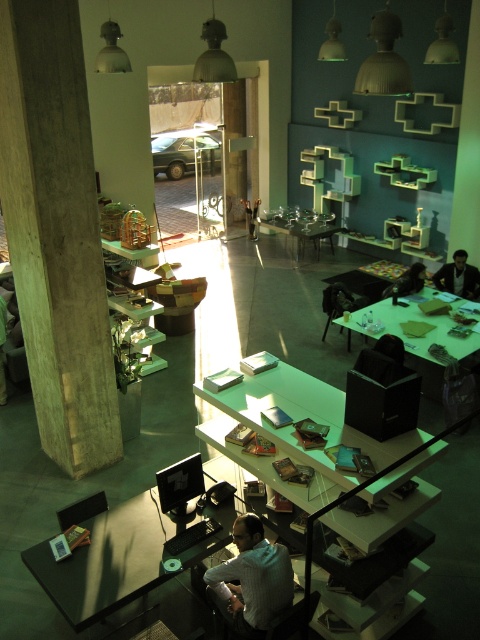
You are a delivery person who needs to place a package on the white glossy table at center. However, there is a dark brown shirt at lower center in the way. Can you move the shirt to access the table?

The white glossy table at center is in front of the dark brown shirt at lower center, meaning the shirt is behind the table. Since the table is already in front, you can directly access the table without needing to move the shirt.

You are an office worker who needs to place a large box on the desk. The box requires a surface area of 1.2 square meters. Given the green matte table at center and the black leather chair at upper right, which object can accommodate the box?

The green matte table at center has a larger size compared to the black leather chair at upper right, so the box can be placed on the green matte table at center.